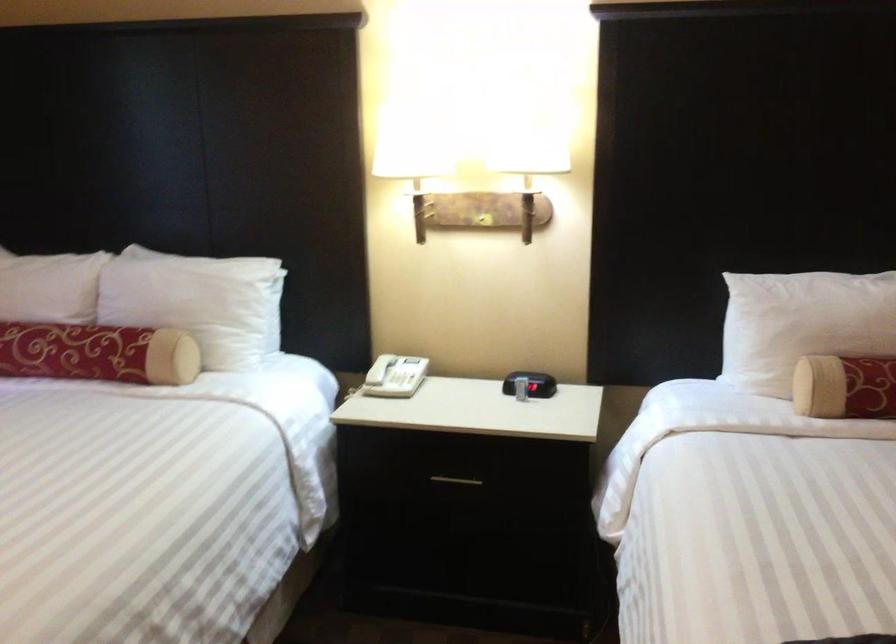
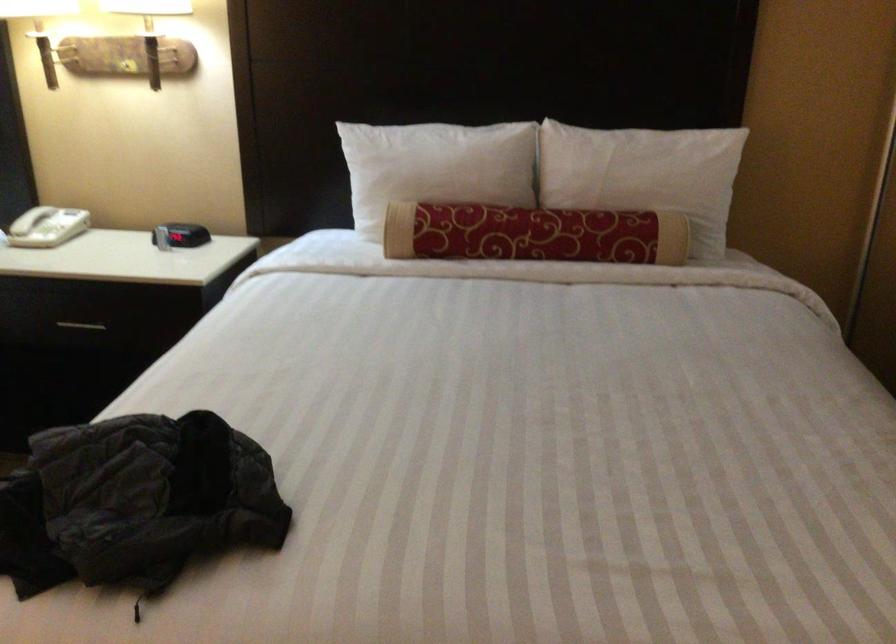
Where in the second image is the point corresponding to (386,371) from the first image?

(30, 220)